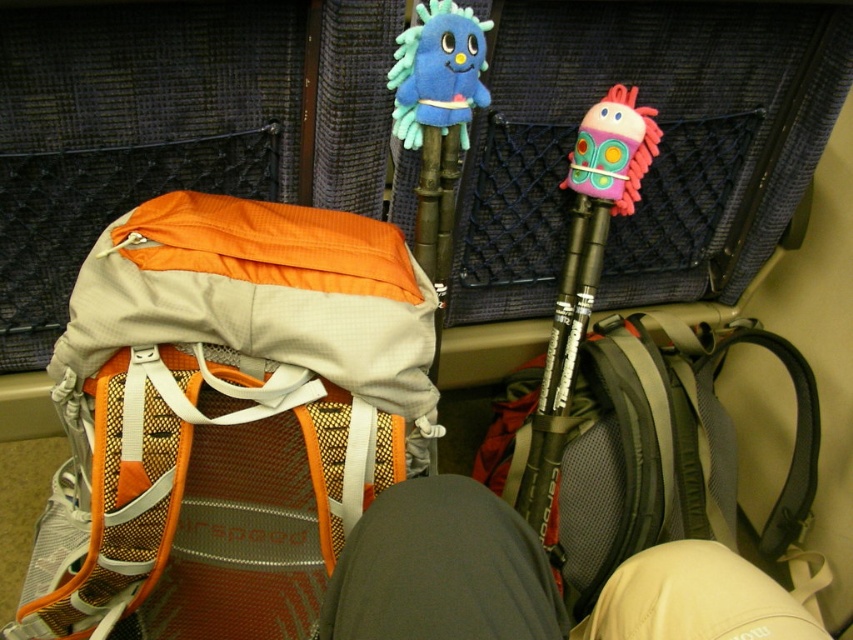
Question: Can you confirm if gray fabric pants at lower center is bigger than blue fuzzy plush toy at upper center?

Choices:
 (A) no
 (B) yes

Answer: (B)

Question: Which of the following is the farthest from the observer?

Choices:
 (A) (590, 108)
 (B) (506, 412)

Answer: (B)

Question: Which point is closer to the camera taking this photo?

Choices:
 (A) (105, 524)
 (B) (575, 602)
 (C) (767, 625)

Answer: (C)

Question: Which object is closer to the camera taking this photo?

Choices:
 (A) orange mesh backpack at center
 (B) gray fabric pants at lower center
 (C) fluffy pink and purple toy at center
 (D) pink fuzzy toy at center

Answer: (B)

Question: Is orange mesh backpack at center to the right of gray fabric pants at lower center from the viewer's perspective?

Choices:
 (A) no
 (B) yes

Answer: (A)

Question: Is the position of pink fuzzy toy at center less distant than that of blue fuzzy plush toy at upper center?

Choices:
 (A) no
 (B) yes

Answer: (A)